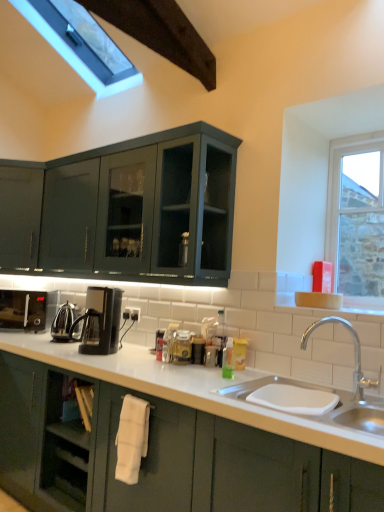
Image resolution: width=384 pixels, height=512 pixels. I want to click on black plastic coffee machine at center, arranged as the 1th coffee machine when viewed from the right, so click(100, 321).

You are a GUI agent. You are given a task and a screenshot of the screen. Output one action in this format:
    pyautogui.click(x=<x>, y=<y>)
    Task: Click on the polished stainless steel kettle at center-left, marked as the 1th appliance in a left-to-right arrangement
    This screenshot has height=512, width=384.
    Given the screenshot: What is the action you would take?
    click(64, 321)

Where is `translucent glass spice jar at center, which is the second appliance from back to front`? translucent glass spice jar at center, which is the second appliance from back to front is located at coordinates (181, 347).

What do you see at coordinates (153, 457) in the screenshot? This screenshot has height=512, width=384. I see `white fabric towel at lower center` at bounding box center [153, 457].

The image size is (384, 512). Find the location of `white glossy sink at lower right`. white glossy sink at lower right is located at coordinates (160, 456).

Looking at the image, does black plastic coffee machine at center, arranged as the 1th coffee machine when viewed from the right, seem bigger or smaller compared to white ceramic sink at lower center?

Considering their sizes, black plastic coffee machine at center, arranged as the 1th coffee machine when viewed from the right, takes up less space than white ceramic sink at lower center.

Does point (102, 309) come in front of point (346, 320)?

No, (102, 309) is further to viewer.

Is black plastic coffee machine at center, the first coffee machine viewed from the front, positioned in front of white ceramic sink at lower center?

No.

Looking at the image, does black plastic coffee machine at center, marked as the second coffee machine in a back-to-front arrangement, seem bigger or smaller compared to white glossy sink at lower right?

Clearly, black plastic coffee machine at center, marked as the second coffee machine in a back-to-front arrangement, is smaller in size than white glossy sink at lower right.

From the image's perspective, is black plastic coffee machine at center, acting as the second coffee machine starting from the left, located above or below white glossy sink at lower right?

Clearly, from the image's perspective, black plastic coffee machine at center, acting as the second coffee machine starting from the left, is above white glossy sink at lower right.

Which is further, (88, 312) or (110, 474)?

The point (88, 312) is farther.

Is black plastic coffee machine at center, arranged as the 1th coffee machine when viewed from the right, at the right side of white glossy sink at lower right?

Incorrect, black plastic coffee machine at center, arranged as the 1th coffee machine when viewed from the right, is not on the right side of white glossy sink at lower right.

Looking at this image, which object is closer to the camera taking this photo, black plastic coffee machine at center, marked as the second coffee machine in a back-to-front arrangement, or white fabric towel at lower center?

Positioned in front is white fabric towel at lower center.

Is black plastic coffee machine at center, acting as the second coffee machine starting from the left, positioned with its back to white fabric towel at lower center?

black plastic coffee machine at center, acting as the second coffee machine starting from the left, is not turned away from white fabric towel at lower center.

Can you confirm if black plastic coffee machine at center, arranged as the 1th coffee machine when viewed from the right, is positioned to the right of white fabric towel at lower center?

No, black plastic coffee machine at center, arranged as the 1th coffee machine when viewed from the right, is not to the right of white fabric towel at lower center.

Which of these two, white ceramic sink at lower center or black plastic coffee machine at center, arranged as the 1th coffee machine when viewed from the right, stands taller?

With more height is white ceramic sink at lower center.

Looking at this image, considering the positions of objects white ceramic sink at lower center and black plastic coffee machine at center, marked as the second coffee machine in a back-to-front arrangement, in the image provided, who is behind, white ceramic sink at lower center or black plastic coffee machine at center, marked as the second coffee machine in a back-to-front arrangement,?

black plastic coffee machine at center, marked as the second coffee machine in a back-to-front arrangement, is more distant.

Looking at their sizes, would you say white ceramic sink at lower center is wider or thinner than black plastic coffee machine at center, the first coffee machine viewed from the front?

In the image, white ceramic sink at lower center appears to be wider than black plastic coffee machine at center, the first coffee machine viewed from the front.

Is white ceramic sink at lower center placed right next to black plastic coffee machine at center, the first coffee machine viewed from the front?

No, white ceramic sink at lower center is not touching black plastic coffee machine at center, the first coffee machine viewed from the front.

Is polished stainless steel kettle at center-left, which is the 1th appliance from back to front, in contact with black plastic coffee machine at lower left, which ranks as the 2th coffee machine in front-to-back order?

polished stainless steel kettle at center-left, which is the 1th appliance from back to front, and black plastic coffee machine at lower left, which ranks as the 2th coffee machine in front-to-back order, are not in contact.

Could you tell me if polished stainless steel kettle at center-left, marked as the second appliance in a front-to-back arrangement, is facing black plastic coffee machine at lower left, the second coffee machine when ordered from right to left?

No, polished stainless steel kettle at center-left, marked as the second appliance in a front-to-back arrangement, is not aimed at black plastic coffee machine at lower left, the second coffee machine when ordered from right to left.

From a real-world perspective, starting from the polished stainless steel kettle at center-left, which is the 1th appliance from back to front, which coffee machine is the 1st one vertically above it? Please provide its 2D coordinates.

[(23, 310)]

Does polished stainless steel kettle at center-left, which is the 1th appliance from back to front, lie behind black plastic coffee machine at lower left, the second coffee machine when ordered from right to left?

No, the depth of polished stainless steel kettle at center-left, which is the 1th appliance from back to front, is less than that of black plastic coffee machine at lower left, the second coffee machine when ordered from right to left.

Considering the positions of point (171, 475) and point (187, 354), is point (171, 475) closer or farther from the camera than point (187, 354)?

Point (171, 475) appears to be closer to the viewer than point (187, 354).

Is white fabric towel at lower center at the left side of translucent glass spice jar at center, which appears as the first appliance when viewed from the front?

Indeed, white fabric towel at lower center is positioned on the left side of translucent glass spice jar at center, which appears as the first appliance when viewed from the front.

From the image's perspective, is white fabric towel at lower center beneath translucent glass spice jar at center, which is the second appliance from back to front?

Yes, from the image's perspective, white fabric towel at lower center is below translucent glass spice jar at center, which is the second appliance from back to front.

Relative to white glossy sink at lower right, is clear glass window at upper right in front or behind?

clear glass window at upper right is positioned farther from the viewer than white glossy sink at lower right.

Considering the relative positions of clear glass window at upper right and white glossy sink at lower right in the image provided, is clear glass window at upper right to the left of white glossy sink at lower right from the viewer's perspective?

In fact, clear glass window at upper right is to the right of white glossy sink at lower right.

Is clear glass window at upper right inside or outside of white glossy sink at lower right?

clear glass window at upper right exists outside the volume of white glossy sink at lower right.

From a real-world perspective, is clear glass window at upper right located beneath white glossy sink at lower right?

No, from a real-world perspective, clear glass window at upper right is not beneath white glossy sink at lower right.

Where is `sink that appears below the black plastic coffee machine at center, marked as the second coffee machine in a back-to-front arrangement (from a real-world perspective)`? The height and width of the screenshot is (512, 384). sink that appears below the black plastic coffee machine at center, marked as the second coffee machine in a back-to-front arrangement (from a real-world perspective) is located at coordinates (353, 391).

The width and height of the screenshot is (384, 512). I want to click on cabinetry below the black plastic coffee machine at center, arranged as the 1th coffee machine when viewed from the right (from the image's perspective), so (x=160, y=456).

Estimate the real-world distances between objects in this image. Which object is closer to black plastic coffee machine at center, acting as the second coffee machine starting from the left, clear glass window at upper right or translucent glass spice jar at center, the 1th appliance positioned from the right?

translucent glass spice jar at center, the 1th appliance positioned from the right, lies closer to black plastic coffee machine at center, acting as the second coffee machine starting from the left, than the other object.

When comparing their distances from black plastic coffee machine at center, the first coffee machine viewed from the front, does black plastic coffee machine at lower left, which is counted as the 1th coffee machine, starting from the back, or white fabric towel at lower center seem further?

Based on the image, black plastic coffee machine at lower left, which is counted as the 1th coffee machine, starting from the back, appears to be further to black plastic coffee machine at center, the first coffee machine viewed from the front.

From the image, which object appears to be nearer to polished stainless steel kettle at center-left, marked as the 1th appliance in a left-to-right arrangement, white glossy sink at lower right or black plastic coffee machine at center, arranged as the 1th coffee machine when viewed from the right?

Based on the image, black plastic coffee machine at center, arranged as the 1th coffee machine when viewed from the right, appears to be nearer to polished stainless steel kettle at center-left, marked as the 1th appliance in a left-to-right arrangement.

Estimate the real-world distances between objects in this image. Which object is further from black plastic coffee machine at center, acting as the second coffee machine starting from the left, polished stainless steel kettle at center-left, marked as the 1th appliance in a left-to-right arrangement, or white fabric towel at lower center?

white fabric towel at lower center.

Which object lies further to the anchor point clear glass window at upper right, white ceramic sink at lower center or polished stainless steel kettle at center-left, marked as the second appliance in a front-to-back arrangement?

polished stainless steel kettle at center-left, marked as the second appliance in a front-to-back arrangement, is further to clear glass window at upper right.

Based on their spatial positions, is translucent glass spice jar at center, which is the second appliance from back to front, or white glossy sink at lower right further from white ceramic sink at lower center?

Based on the image, translucent glass spice jar at center, which is the second appliance from back to front, appears to be further to white ceramic sink at lower center.

When comparing their distances from translucent glass spice jar at center, which appears as the first appliance when viewed from the front, does black plastic coffee machine at lower left, which ranks as the 2th coffee machine in front-to-back order, or black plastic coffee machine at center, arranged as the 1th coffee machine when viewed from the right, seem further?

The object further to translucent glass spice jar at center, which appears as the first appliance when viewed from the front, is black plastic coffee machine at lower left, which ranks as the 2th coffee machine in front-to-back order.

Considering their positions, is white glossy sink at lower right positioned further to white fabric towel at lower center than black plastic coffee machine at center, the first coffee machine viewed from the front?

Based on the image, black plastic coffee machine at center, the first coffee machine viewed from the front, appears to be further to white fabric towel at lower center.

The height and width of the screenshot is (512, 384). Identify the location of sink between white glossy sink at lower right and black plastic coffee machine at lower left, acting as the first coffee machine starting from the left, from front to back. (353, 391).

The width and height of the screenshot is (384, 512). In order to click on cabinetry situated between black plastic coffee machine at center, acting as the second coffee machine starting from the left, and clear glass window at upper right from left to right in this screenshot , I will do `click(160, 456)`.

At what (x,y) coordinates should I click in order to perform the action: click on sink situated between black plastic coffee machine at center, marked as the second coffee machine in a back-to-front arrangement, and clear glass window at upper right from left to right. Please return your answer as a coordinate pair (x, y). Looking at the image, I should click on (353, 391).

Find the location of a particular element. The width and height of the screenshot is (384, 512). appliance located between white ceramic sink at lower center and black plastic coffee machine at center, acting as the second coffee machine starting from the left, in the depth direction is located at coordinates (181, 347).